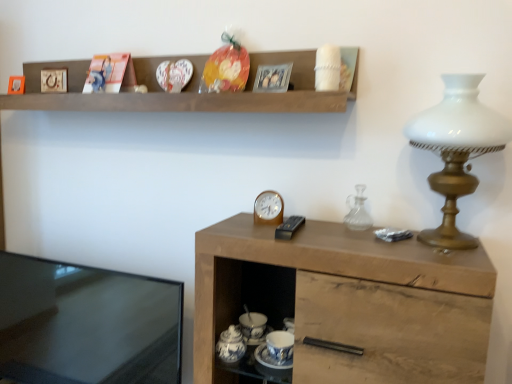
Locate an element on the screen. vacant point above wooden cabinet at right (from a real-world perspective) is located at coordinates (340, 232).